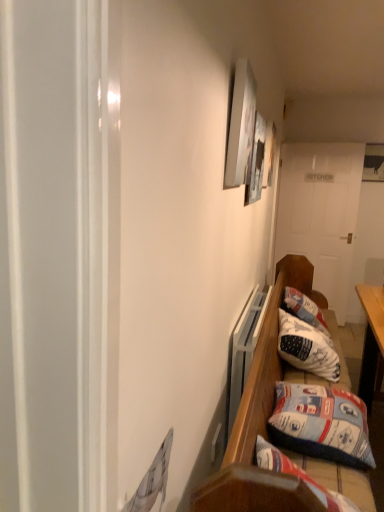
Question: From the image's perspective, is white wooden door at center on matte white picture frame at upper center, placed as the 2th picture frame when sorted from right to left?

Choices:
 (A) yes
 (B) no

Answer: (B)

Question: Is white wooden door at center wider than matte white picture frame at upper center, which is the 1th picture frame in left-to-right order?

Choices:
 (A) yes
 (B) no

Answer: (A)

Question: Does white wooden door at center have a smaller size compared to matte white picture frame at upper center, which is the 1th picture frame in left-to-right order?

Choices:
 (A) yes
 (B) no

Answer: (B)

Question: Considering the relative positions of white wooden door at center and matte white picture frame at upper center, which is the first picture frame in front-to-back order, in the image provided, is white wooden door at center to the left of matte white picture frame at upper center, which is the first picture frame in front-to-back order, from the viewer's perspective?

Choices:
 (A) yes
 (B) no

Answer: (B)

Question: Considering the relative sizes of white wooden door at center and matte white picture frame at upper center, which is the 1th picture frame in left-to-right order, in the image provided, is white wooden door at center taller than matte white picture frame at upper center, which is the 1th picture frame in left-to-right order,?

Choices:
 (A) yes
 (B) no

Answer: (A)

Question: Is matte white picture frame at upper center, which is counted as the second picture frame, starting from the back, wider or thinner than white fabric pillow at lower right, the 2th pillow in the front-to-back sequence?

Choices:
 (A) wide
 (B) thin

Answer: (B)

Question: Would you say matte white picture frame at upper center, which is counted as the second picture frame, starting from the back, is to the left or to the right of white fabric pillow at lower right, the 2th pillow in the front-to-back sequence, in the picture?

Choices:
 (A) right
 (B) left

Answer: (B)

Question: From the image's perspective, is matte white picture frame at upper center, which is the first picture frame in front-to-back order, located above or below white fabric pillow at lower right, positioned as the first pillow in back-to-front order?

Choices:
 (A) below
 (B) above

Answer: (B)

Question: Considering the positions of matte white picture frame at upper center, which is counted as the second picture frame, starting from the back, and white fabric pillow at lower right, the 2th pillow in the front-to-back sequence, in the image, is matte white picture frame at upper center, which is counted as the second picture frame, starting from the back, taller or shorter than white fabric pillow at lower right, the 2th pillow in the front-to-back sequence,?

Choices:
 (A) tall
 (B) short

Answer: (A)

Question: Is blue fabric pillow at lower right, positioned as the 2th pillow in back-to-front order, in front of or behind white wooden door at center in the image?

Choices:
 (A) front
 (B) behind

Answer: (A)

Question: From the image's perspective, is blue fabric pillow at lower right, which ranks as the first pillow in front-to-back order, positioned above or below white wooden door at center?

Choices:
 (A) above
 (B) below

Answer: (B)

Question: From a real-world perspective, is blue fabric pillow at lower right, which ranks as the first pillow in front-to-back order, positioned above or below white wooden door at center?

Choices:
 (A) above
 (B) below

Answer: (B)

Question: Is blue fabric pillow at lower right, positioned as the 2th pillow in back-to-front order, inside or outside of white wooden door at center?

Choices:
 (A) inside
 (B) outside

Answer: (B)

Question: Is white wooden door at center spatially inside white fabric pillow at lower right, positioned as the first pillow in back-to-front order, or outside of it?

Choices:
 (A) inside
 (B) outside

Answer: (B)

Question: In the image, is white wooden door at center positioned in front of or behind white fabric pillow at lower right, the 2th pillow in the front-to-back sequence?

Choices:
 (A) behind
 (B) front

Answer: (A)